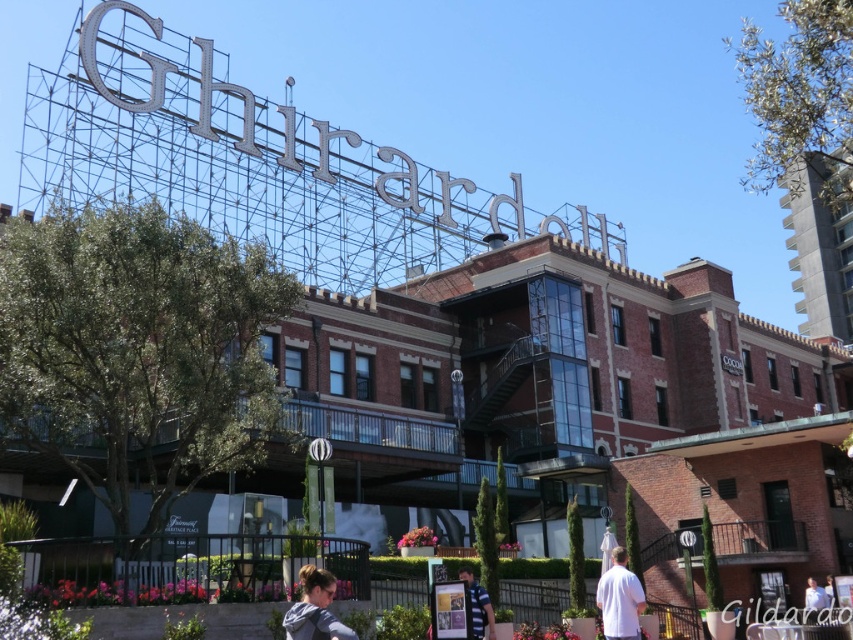
Question: Is white matte shirt at lower right smaller than blue striped shirt at center?

Choices:
 (A) no
 (B) yes

Answer: (B)

Question: Which of the following is the farthest from the observer?

Choices:
 (A) (474, 618)
 (B) (332, 628)

Answer: (A)

Question: Can you confirm if white matte shirt at lower right is positioned below blue striped shirt at center?

Choices:
 (A) no
 (B) yes

Answer: (B)

Question: Is blonde hair at lower center positioned behind white matte shirt at lower right?

Choices:
 (A) yes
 (B) no

Answer: (B)

Question: Based on their relative distances, which object is nearer to the blonde hair at lower center?

Choices:
 (A) blue striped shirt at center
 (B) white matte shirt at lower right

Answer: (A)

Question: Which object is positioned closest to the white matte shirt at lower right?

Choices:
 (A) blonde hair at lower center
 (B) blue striped shirt at center

Answer: (B)